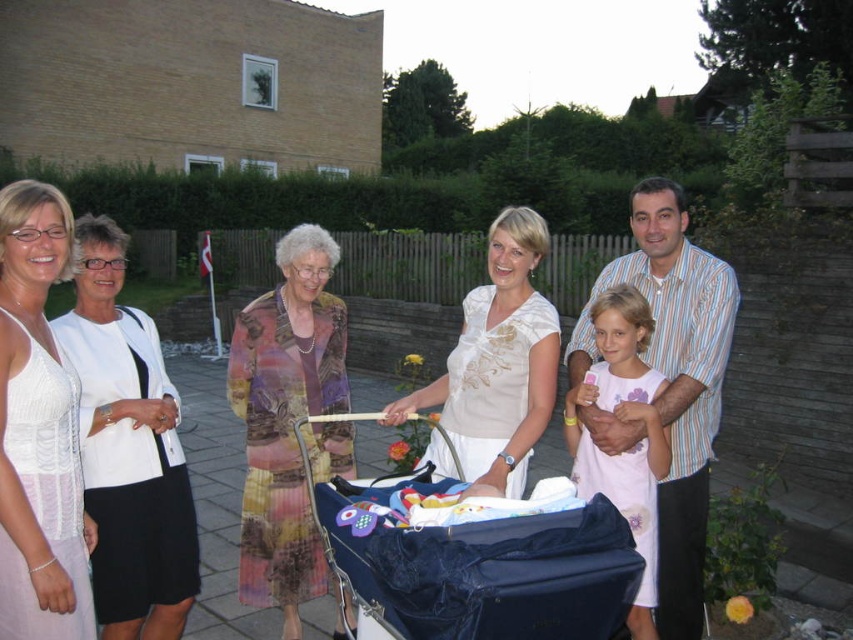
You are a photographer trying to capture a group photo of the matte floral dress at center and the white lace dress at left. If you want to ensure both dresses are fully visible in the frame, which dress requires more space horizontally?

The matte floral dress at center might require more space horizontally since it is wider than the white lace dress at left.

You are a photographer at the event and need to focus your camera on the white embroidered blouse at center. What are the coordinates where you should aim your camera?

The coordinates to focus on are point [498,364].

You are a photographer standing at the edge of the backyard, and you want to take a photo of the matte floral dress at center and the stroller covered with dark blue fabric. How far apart are these two items from each other?

The matte floral dress at center and the stroller covered with dark blue fabric are 8.82 feet apart.